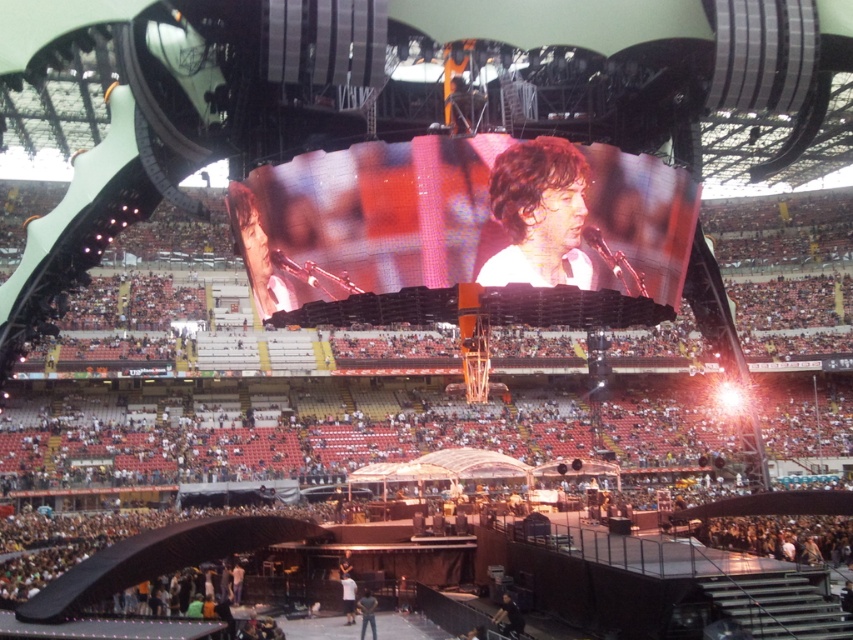
Question: Does shiny black hair at center have a larger size compared to dark brown leather jacket at lower center?

Choices:
 (A) yes
 (B) no

Answer: (A)

Question: From the image, what is the correct spatial relationship of shiny black hair at center in relation to blurred skin person at center?

Choices:
 (A) above
 (B) below

Answer: (A)

Question: Is blurred skin person at center above white cotton shirt at center?

Choices:
 (A) yes
 (B) no

Answer: (A)

Question: Which point is farther to the camera?

Choices:
 (A) blurred skin person at center
 (B) shiny black hair at center
 (C) dark brown leather jacket at lower center
 (D) white cotton shirt at center

Answer: (D)

Question: Which object appears closest to the camera in this image?

Choices:
 (A) white cotton shirt at center
 (B) dark brown leather jacket at lower center

Answer: (B)

Question: Which object is farther from the camera taking this photo?

Choices:
 (A) shiny black hair at center
 (B) dark brown leather jacket at lower center
 (C) blurred skin person at center

Answer: (C)